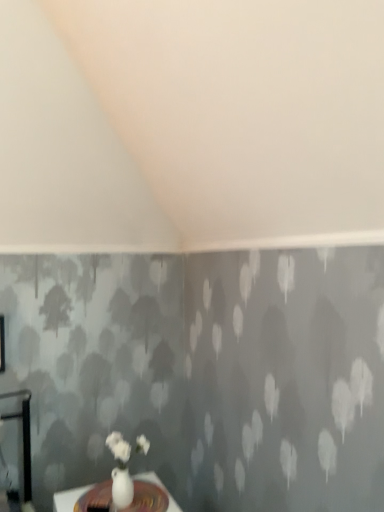
This screenshot has height=512, width=384. In order to click on white glossy vase at lower center in this screenshot , I will do `click(120, 471)`.

The width and height of the screenshot is (384, 512). What do you see at coordinates (120, 471) in the screenshot?
I see `white glossy vase at lower center` at bounding box center [120, 471].

You are a GUI agent. You are given a task and a screenshot of the screen. Output one action in this format:
    pyautogui.click(x=<x>, y=<y>)
    Task: Click on the white glossy vase at lower center
    The image size is (384, 512).
    Given the screenshot: What is the action you would take?
    pyautogui.click(x=68, y=498)

What do you see at coordinates (68, 498) in the screenshot? This screenshot has height=512, width=384. I see `white glossy vase at lower center` at bounding box center [68, 498].

Locate an element on the screen. This screenshot has height=512, width=384. white glossy vase at lower center is located at coordinates (120, 471).

Is white glossy vase at lower center to the right of white glossy vase at lower center from the viewer's perspective?

Incorrect, white glossy vase at lower center is not on the right side of white glossy vase at lower center.

Is white glossy vase at lower center positioned before white glossy vase at lower center?

Yes.

Which point is more forward, (86, 490) or (110, 445)?

The point (110, 445) is closer.

From the image's perspective, which one is positioned higher, white glossy vase at lower center or white glossy vase at lower center?

white glossy vase at lower center.

From a real-world perspective, between white glossy vase at lower center and white glossy vase at lower center, who is vertically lower?

white glossy vase at lower center, from a real-world perspective.

From the picture: Does white glossy vase at lower center have a greater width compared to white glossy vase at lower center?

Yes.

Who is shorter, white glossy vase at lower center or white glossy vase at lower center?

Standing shorter between the two is white glossy vase at lower center.

Which of these two, white glossy vase at lower center or white glossy vase at lower center, is bigger?

Bigger between the two is white glossy vase at lower center.

Would you say white glossy vase at lower center is inside or outside white glossy vase at lower center?

white glossy vase at lower center lies outside white glossy vase at lower center.

Are white glossy vase at lower center and white glossy vase at lower center beside each other?

No, white glossy vase at lower center is not beside white glossy vase at lower center.

Is white glossy vase at lower center facing away from white glossy vase at lower center?

No, white glossy vase at lower center is not facing away from white glossy vase at lower center.

Where is `table below the white glossy vase at lower center (from the image's perspective)`? The width and height of the screenshot is (384, 512). table below the white glossy vase at lower center (from the image's perspective) is located at coordinates (68, 498).

Is white glossy vase at lower center to the left or to the right of white glossy vase at lower center in the image?

white glossy vase at lower center is positioned on white glossy vase at lower center's right side.

Which is behind, white glossy vase at lower center or white glossy vase at lower center?

white glossy vase at lower center is further from the camera.

Considering the points (137, 445) and (138, 478), which point is behind, point (137, 445) or point (138, 478)?

The point (138, 478) is farther.

From the image's perspective, which object appears higher, white glossy vase at lower center or white glossy vase at lower center?

white glossy vase at lower center is shown above in the image.

From a real-world perspective, who is located higher, white glossy vase at lower center or white glossy vase at lower center?

From a 3D spatial view, white glossy vase at lower center is above.

Which object is thinner, white glossy vase at lower center or white glossy vase at lower center?

white glossy vase at lower center is thinner.

Considering the relative sizes of white glossy vase at lower center and white glossy vase at lower center in the image provided, is white glossy vase at lower center taller than white glossy vase at lower center?

Yes.

Can you confirm if white glossy vase at lower center is bigger than white glossy vase at lower center?

Actually, white glossy vase at lower center might be smaller than white glossy vase at lower center.

Do you think white glossy vase at lower center is within white glossy vase at lower center, or outside of it?

white glossy vase at lower center is not inside white glossy vase at lower center, it's outside.

Is white glossy vase at lower center far from white glossy vase at lower center?

Actually, white glossy vase at lower center and white glossy vase at lower center are a little close together.

Is white glossy vase at lower center aimed at white glossy vase at lower center?

No.

How much distance is there between white glossy vase at lower center and white glossy vase at lower center?

white glossy vase at lower center and white glossy vase at lower center are 26.67 centimeters apart.

Identify the location of floral arrangement that appears above the white glossy vase at lower center (from a real-world perspective). Image resolution: width=384 pixels, height=512 pixels. (120, 471).

Locate an element on the screen. This screenshot has width=384, height=512. table located on the left of white glossy vase at lower center is located at coordinates (68, 498).

Identify the location of floral arrangement above the white glossy vase at lower center (from the image's perspective). (120, 471).